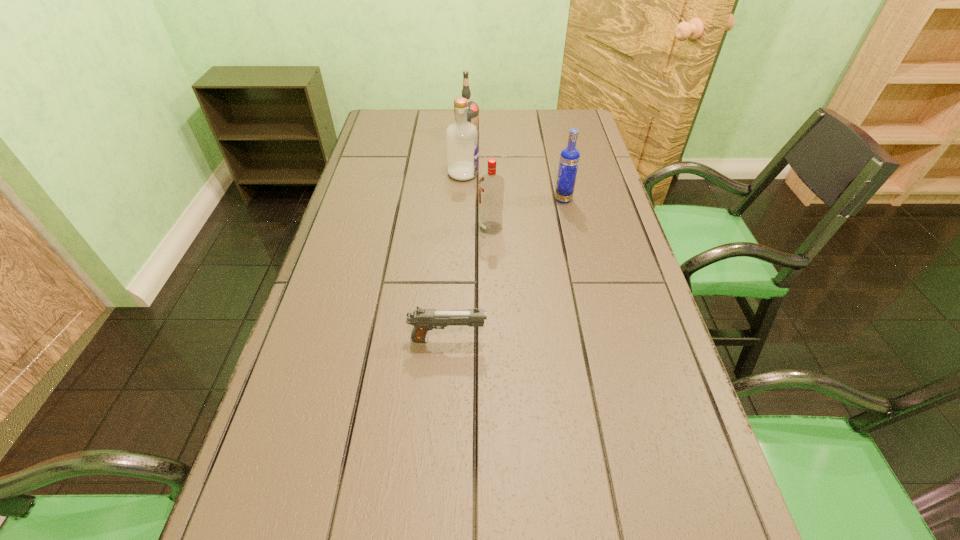
The width and height of the screenshot is (960, 540). What are the coordinates of `vodka that can be found as the third closest to the rightmost object` in the screenshot? It's located at (473, 109).

Find the location of a particular element. The height and width of the screenshot is (540, 960). free region that satisfies the following two spatial constraints: 1. on the label of the rightmost vodka; 2. on the left side of the second farthest vodka is located at coordinates [462, 199].